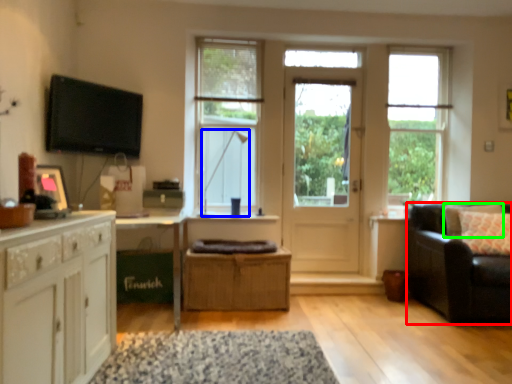
Question: Estimate the real-world distances between objects in this image. Which object is farther from studio couch (highlighted by a red box), lamp (highlighted by a blue box) or pillow (highlighted by a green box)?

Choices:
 (A) lamp
 (B) pillow

Answer: (A)